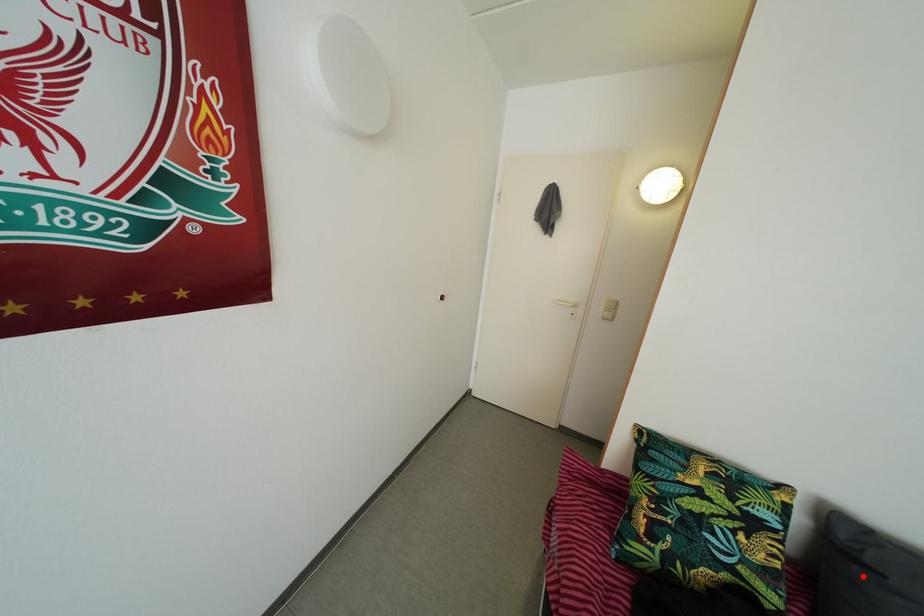
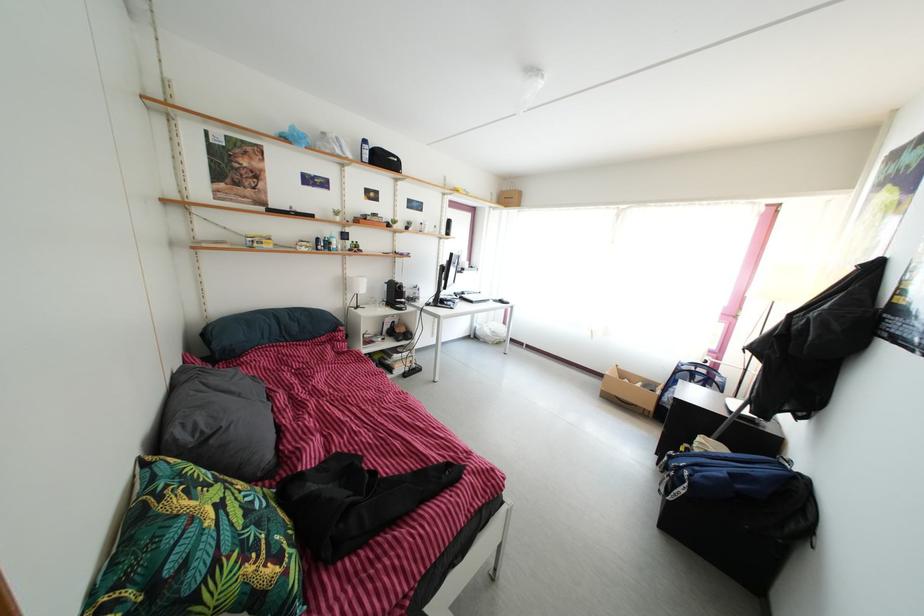
Find the pixel in the second image that matches the highlighted location in the first image.

(217, 450)